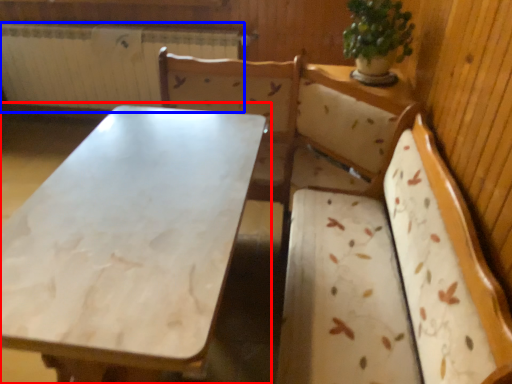
Question: Which object is further to the camera taking this photo, table (highlighted by a red box) or radiator (highlighted by a blue box)?

Choices:
 (A) table
 (B) radiator

Answer: (B)